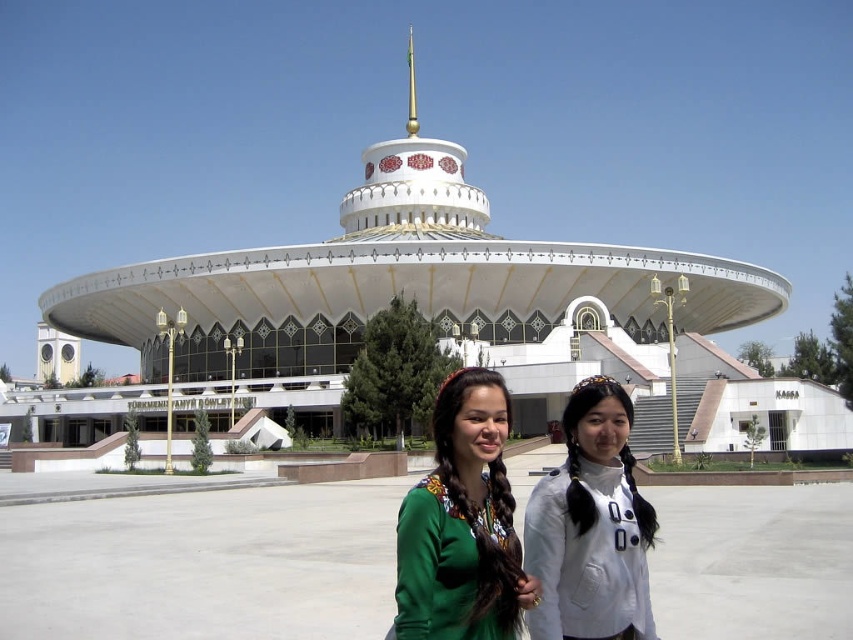
Looking at this image, does green woven blouse at center have a larger size compared to white matte shirt at center?

Yes, green woven blouse at center is bigger than white matte shirt at center.

The image size is (853, 640). What do you see at coordinates (462, 524) in the screenshot?
I see `green woven blouse at center` at bounding box center [462, 524].

Between point (433, 621) and point (573, 504), which one is positioned behind?

The point (573, 504) is behind.

Where is `green woven blouse at center`? green woven blouse at center is located at coordinates (462, 524).